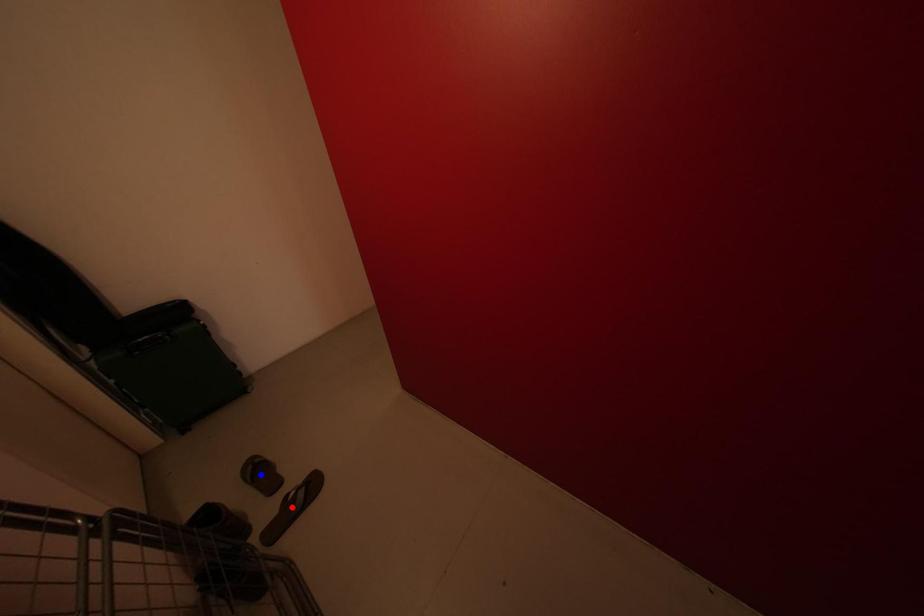
Question: Two points are marked on the image. Which point is closer to the camera?

Choices:
 (A) Blue point is closer.
 (B) Red point is closer.

Answer: (B)